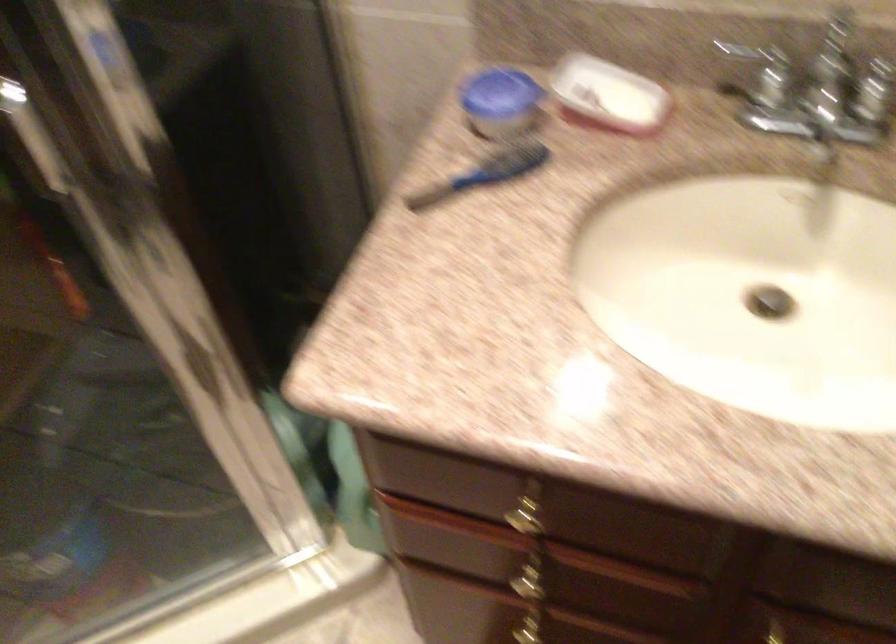
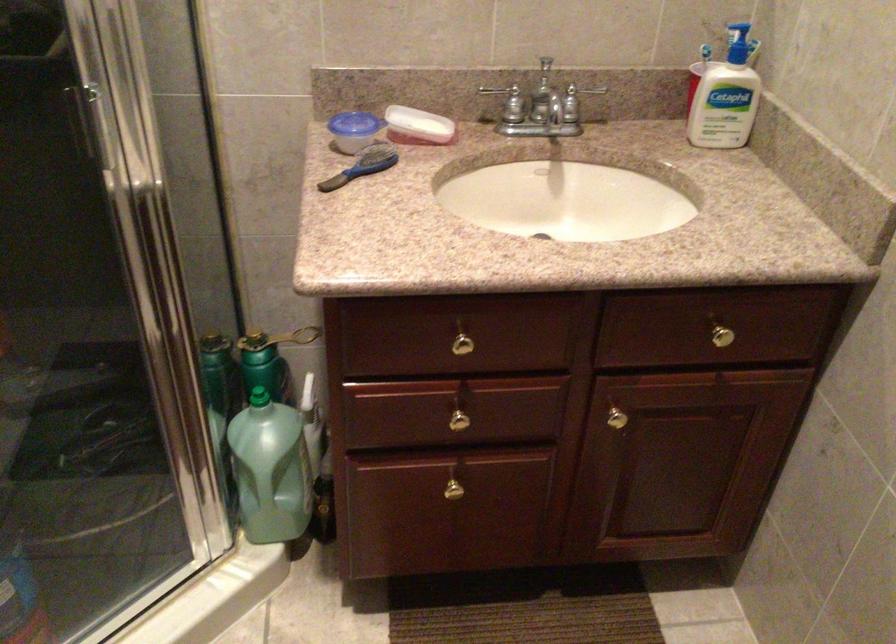
The point at (481,100) is marked in the first image. Where is the corresponding point in the second image?

(343, 126)